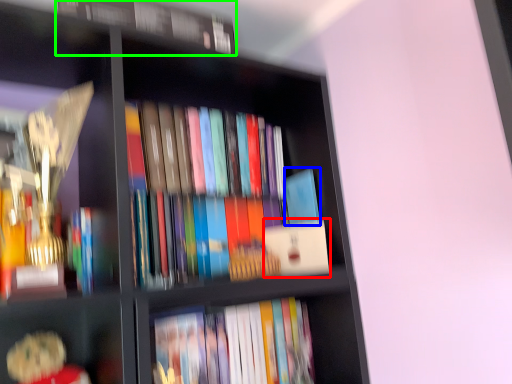
Question: Which is nearer to the paperback book (highlighted by a red box)? paperback book (highlighted by a blue box) or book (highlighted by a green box).

Choices:
 (A) paperback book
 (B) book

Answer: (A)